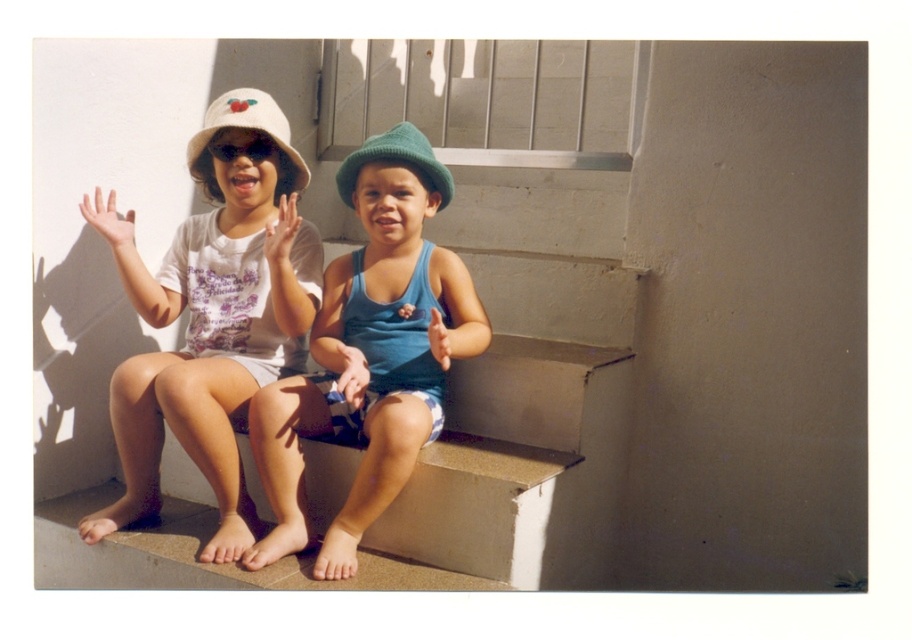
You are a photographer trying to capture the scene of the two children on the smooth concrete stairs at center. You notice the matte white hand at center in your shot. Based on their positions, which object is located to the right side in the image?

The smooth concrete stairs at center are located to the right of the matte white hand at center, so the smooth concrete stairs at center is on the right side in the image.

You are a photographer trying to capture a closeup of both points in the image. Which point, point (386, 436) or point (358, 164), should you focus on first to ensure it appears sharp in the photo?

Point (386, 436) is closer to the viewer than point (358, 164), so you should focus on point (386, 436) first to ensure it appears sharp in the photo.